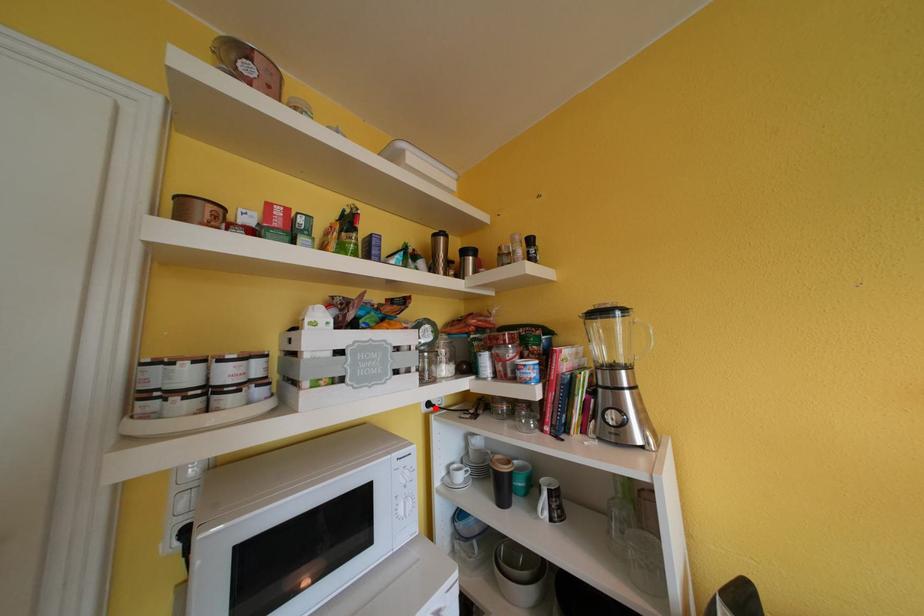
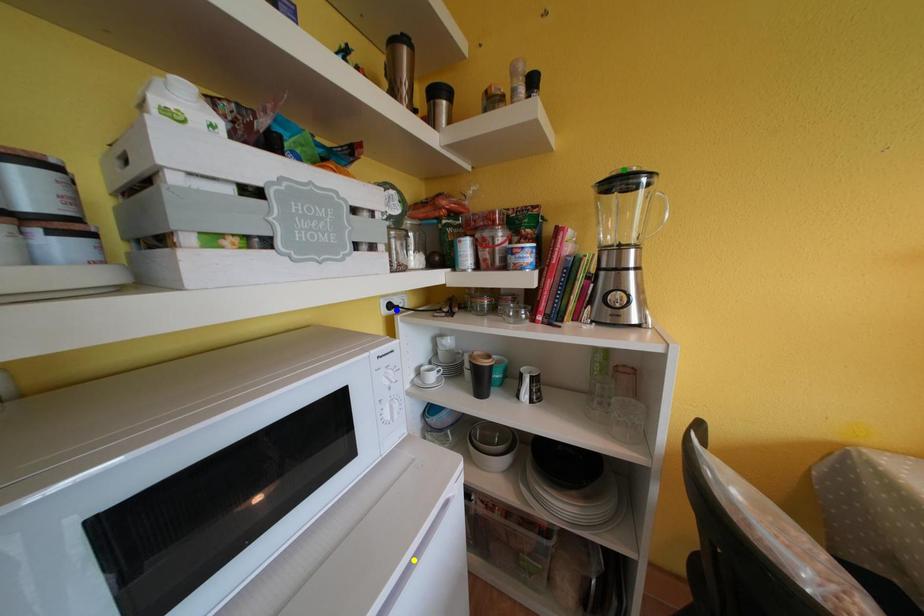
Question: I am providing you with two images of the same scene from different viewpoints. A red point is marked on the first image. You are given multiple points on the second image. Can you choose the point in image 2 that corresponds to the point in image 1?

Choices:
 (A) yellow point
 (B) blue point
 (C) green point

Answer: (B)